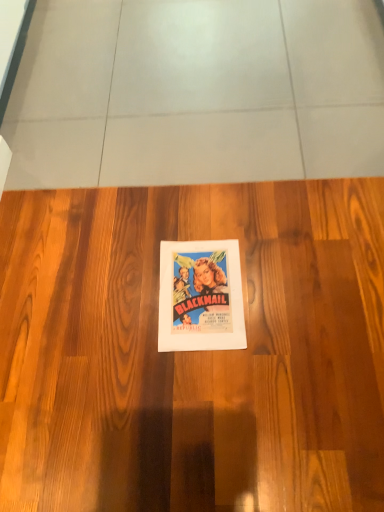
Question: Considering the relative sizes of vibrant paper poster at center and wooden floor at center in the image provided, is vibrant paper poster at center thinner than wooden floor at center?

Choices:
 (A) yes
 (B) no

Answer: (A)

Question: Does vibrant paper poster at center have a lesser height compared to wooden floor at center?

Choices:
 (A) yes
 (B) no

Answer: (A)

Question: Would you say wooden floor at center is part of vibrant paper poster at center's contents?

Choices:
 (A) yes
 (B) no

Answer: (B)

Question: Can you confirm if vibrant paper poster at center is positioned to the right of wooden floor at center?

Choices:
 (A) no
 (B) yes

Answer: (B)

Question: Would you say vibrant paper poster at center is outside wooden floor at center?

Choices:
 (A) no
 (B) yes

Answer: (A)

Question: From a real-world perspective, is vibrant paper poster at center on top of wooden floor at center?

Choices:
 (A) yes
 (B) no

Answer: (A)

Question: Does wooden floor at center have a lesser height compared to vibrant paper poster at center?

Choices:
 (A) no
 (B) yes

Answer: (A)

Question: Can you confirm if wooden floor at center is wider than vibrant paper poster at center?

Choices:
 (A) no
 (B) yes

Answer: (B)

Question: From the image's perspective, is wooden floor at center on vibrant paper poster at center?

Choices:
 (A) no
 (B) yes

Answer: (B)

Question: Is wooden floor at center facing towards vibrant paper poster at center?

Choices:
 (A) no
 (B) yes

Answer: (A)

Question: Is wooden floor at center behind vibrant paper poster at center?

Choices:
 (A) no
 (B) yes

Answer: (A)

Question: Considering the relative positions of wooden floor at center and vibrant paper poster at center in the image provided, is wooden floor at center to the right of vibrant paper poster at center from the viewer's perspective?

Choices:
 (A) no
 (B) yes

Answer: (A)

Question: Which is correct: wooden floor at center is inside vibrant paper poster at center, or outside of it?

Choices:
 (A) inside
 (B) outside

Answer: (B)